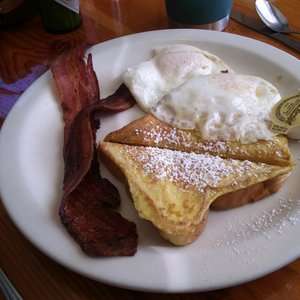
You are a GUI agent. You are given a task and a screenshot of the screen. Output one action in this format:
    pyautogui.click(x=<x>, y=<y>)
    Task: Click on the spoon
    
    Given the screenshot: What is the action you would take?
    pyautogui.click(x=283, y=28)